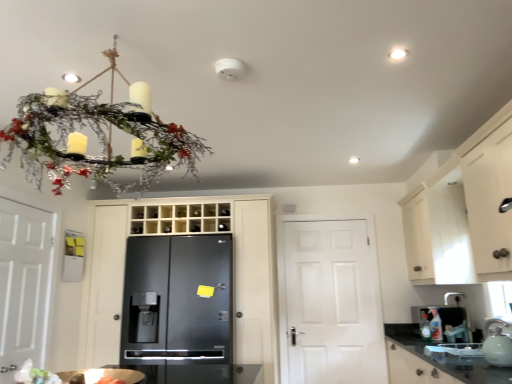
What do you see at coordinates (24, 284) in the screenshot? I see `white matte door at left, which is the first door in left-to-right order` at bounding box center [24, 284].

What do you see at coordinates (464, 212) in the screenshot? I see `white wood cabinet at upper right` at bounding box center [464, 212].

Where is `white glossy tea pot at lower right`? The image size is (512, 384). white glossy tea pot at lower right is located at coordinates (498, 349).

The image size is (512, 384). Identify the location of white matte door at left, which is the first door in left-to-right order. (24, 284).

From the image's perspective, is glossy black refrigerator at center, the second door when ordered from right to left, over black matte refrigerator at center?

Yes.

Is glossy black refrigerator at center, marked as the second door in a left-to-right arrangement, looking in the opposite direction of black matte refrigerator at center?

That's right, glossy black refrigerator at center, marked as the second door in a left-to-right arrangement, is facing away from black matte refrigerator at center.

Are glossy black refrigerator at center, marked as the second door in a left-to-right arrangement, and black matte refrigerator at center making contact?

No, glossy black refrigerator at center, marked as the second door in a left-to-right arrangement, is not making contact with black matte refrigerator at center.

From a real-world perspective, between black matte refrigerator at center and white glossy tea pot at lower right, who is vertically higher?

A: black matte refrigerator at center is physically above.

At what (x,y) coordinates should I click in order to perform the action: click on tea pot in front of the black matte refrigerator at center. Please return your answer as a coordinate pair (x, y). Looking at the image, I should click on (498, 349).

Is point (146, 276) positioned in front of point (498, 360)?

No, (146, 276) is behind (498, 360).

Considering the sizes of objects white matte door at center, marked as the first door in a right-to-left arrangement, and glossy black refrigerator at center, marked as the second door in a left-to-right arrangement, in the image provided, who is wider, white matte door at center, marked as the first door in a right-to-left arrangement, or glossy black refrigerator at center, marked as the second door in a left-to-right arrangement,?

glossy black refrigerator at center, marked as the second door in a left-to-right arrangement, is wider.

Consider the image. Can you tell me how much white matte door at center, marked as the 3th door in a left-to-right arrangement, and glossy black refrigerator at center, the second door when ordered from right to left, differ in facing direction?

The angular difference between white matte door at center, marked as the 3th door in a left-to-right arrangement, and glossy black refrigerator at center, the second door when ordered from right to left, is 0.35 degrees.

Consider the image. Can glossy black refrigerator at center, marked as the second door in a left-to-right arrangement, be found inside white matte door at center, marked as the 3th door in a left-to-right arrangement?

Definitely not — glossy black refrigerator at center, marked as the second door in a left-to-right arrangement, is not inside white matte door at center, marked as the 3th door in a left-to-right arrangement.

Is white matte door at center, marked as the first door in a right-to-left arrangement, placed right next to matte white chandelier at upper left?

white matte door at center, marked as the first door in a right-to-left arrangement, is not next to matte white chandelier at upper left, and they're not touching.

Would you say white matte door at center, marked as the 3th door in a left-to-right arrangement, contains matte white chandelier at upper left?

Actually, matte white chandelier at upper left is outside white matte door at center, marked as the 3th door in a left-to-right arrangement.

Looking at this image, considering the sizes of objects white matte door at center, marked as the 3th door in a left-to-right arrangement, and matte white chandelier at upper left in the image provided, who is thinner, white matte door at center, marked as the 3th door in a left-to-right arrangement, or matte white chandelier at upper left?

With smaller width is white matte door at center, marked as the 3th door in a left-to-right arrangement.

Considering the relative positions of white matte door at center, marked as the 3th door in a left-to-right arrangement, and matte white chandelier at upper left in the image provided, is white matte door at center, marked as the 3th door in a left-to-right arrangement, to the left of matte white chandelier at upper left from the viewer's perspective?

No.

Considering the sizes of glossy black refrigerator at center, marked as the second door in a left-to-right arrangement, and white glossy tea pot at lower right in the image, is glossy black refrigerator at center, marked as the second door in a left-to-right arrangement, taller or shorter than white glossy tea pot at lower right?

glossy black refrigerator at center, marked as the second door in a left-to-right arrangement, is taller than white glossy tea pot at lower right.

From a real-world perspective, does glossy black refrigerator at center, the second door when ordered from right to left, sit lower than white glossy tea pot at lower right?

A: No, from a real-world perspective, glossy black refrigerator at center, the second door when ordered from right to left, is not below white glossy tea pot at lower right.

Which is nearer, (257, 244) or (507, 346)?

The point (507, 346) is more forward.

Can you confirm if glossy black refrigerator at center, the second door when ordered from right to left, is positioned to the left of white glossy tea pot at lower right?

Correct, you'll find glossy black refrigerator at center, the second door when ordered from right to left, to the left of white glossy tea pot at lower right.

Can you confirm if white matte door at left, which is the first door in left-to-right order, is wider than black granite countertop at lower right?

In fact, white matte door at left, which is the first door in left-to-right order, might be narrower than black granite countertop at lower right.

From the image's perspective, between white matte door at left, which is the first door in left-to-right order, and black granite countertop at lower right, who is located below?

black granite countertop at lower right, from the image's perspective.

Is the depth of white matte door at left, which is the first door in left-to-right order, less than that of black granite countertop at lower right?

→ That is False.

Considering the positions of points (50, 232) and (406, 345), is point (50, 232) farther from camera compared to point (406, 345)?

No, it is in front of (406, 345).

Do you think white glossy tea pot at lower right is within white matte door at left, which is counted as the 3th door, starting from the right, or outside of it?

white glossy tea pot at lower right is spatially situated outside white matte door at left, which is counted as the 3th door, starting from the right.

From the image's perspective, who appears lower, white glossy tea pot at lower right or white matte door at left, which is counted as the 3th door, starting from the right?

white glossy tea pot at lower right, from the image's perspective.

Is white glossy tea pot at lower right with white matte door at left, which is counted as the 3th door, starting from the right?

No, white glossy tea pot at lower right is not beside white matte door at left, which is counted as the 3th door, starting from the right.

The width and height of the screenshot is (512, 384). I want to click on refrigerator in front of the glossy black refrigerator at center, the second door when ordered from right to left, so click(177, 308).

Find the location of a particular element. refrigerator behind the white glossy tea pot at lower right is located at coordinates (177, 308).

Which object lies further to the anchor point glossy black refrigerator at center, marked as the second door in a left-to-right arrangement, matte white chandelier at upper left or black matte refrigerator at center?

The object further to glossy black refrigerator at center, marked as the second door in a left-to-right arrangement, is matte white chandelier at upper left.

From the image, which object appears to be nearer to white matte door at center, marked as the 3th door in a left-to-right arrangement, white glossy tea pot at lower right or black matte refrigerator at center?

black matte refrigerator at center is positioned closer to the anchor white matte door at center, marked as the 3th door in a left-to-right arrangement.

Based on their spatial positions, is glossy black refrigerator at center, marked as the second door in a left-to-right arrangement, or white matte door at center, marked as the first door in a right-to-left arrangement, closer to white matte door at left, which is the first door in left-to-right order?

glossy black refrigerator at center, marked as the second door in a left-to-right arrangement, is closer to white matte door at left, which is the first door in left-to-right order.

When comparing their distances from white matte door at center, marked as the 3th door in a left-to-right arrangement, does black matte refrigerator at center or matte white chandelier at upper left seem further?

Among the two, matte white chandelier at upper left is located further to white matte door at center, marked as the 3th door in a left-to-right arrangement.

Based on their spatial positions, is white wood cabinet at upper right or matte white chandelier at upper left further from black granite countertop at lower right?

Based on the image, matte white chandelier at upper left appears to be further to black granite countertop at lower right.

From the image, which object appears to be farther from white glossy tea pot at lower right, glossy black refrigerator at center, marked as the second door in a left-to-right arrangement, or white matte door at center, marked as the 3th door in a left-to-right arrangement?

The object further to white glossy tea pot at lower right is glossy black refrigerator at center, marked as the second door in a left-to-right arrangement.

In the scene shown: Based on their spatial positions, is black matte refrigerator at center or white matte door at left, which is counted as the 3th door, starting from the right, closer to white wood cabinet at upper right?

The object closer to white wood cabinet at upper right is black matte refrigerator at center.

When comparing their distances from matte white chandelier at upper left, does black matte refrigerator at center or white wood cabinet at upper right seem further?

white wood cabinet at upper right lies further to matte white chandelier at upper left than the other object.

Where is `refrigerator between white matte door at left, which is counted as the 3th door, starting from the right, and white matte door at center, marked as the 3th door in a left-to-right arrangement, in the horizontal direction`? refrigerator between white matte door at left, which is counted as the 3th door, starting from the right, and white matte door at center, marked as the 3th door in a left-to-right arrangement, in the horizontal direction is located at coordinates (177, 308).

I want to click on refrigerator between white matte door at left, which is counted as the 3th door, starting from the right, and white wood cabinet at upper right, so click(177, 308).

Where is `cabinetry located between matte white chandelier at upper left and white matte door at center, marked as the 3th door in a left-to-right arrangement, in the depth direction`? cabinetry located between matte white chandelier at upper left and white matte door at center, marked as the 3th door in a left-to-right arrangement, in the depth direction is located at coordinates click(x=464, y=212).

At what (x,y) coordinates should I click in order to perform the action: click on refrigerator positioned between matte white chandelier at upper left and white matte door at center, marked as the first door in a right-to-left arrangement, from near to far. Please return your answer as a coordinate pair (x, y). This screenshot has height=384, width=512. Looking at the image, I should click on (177, 308).